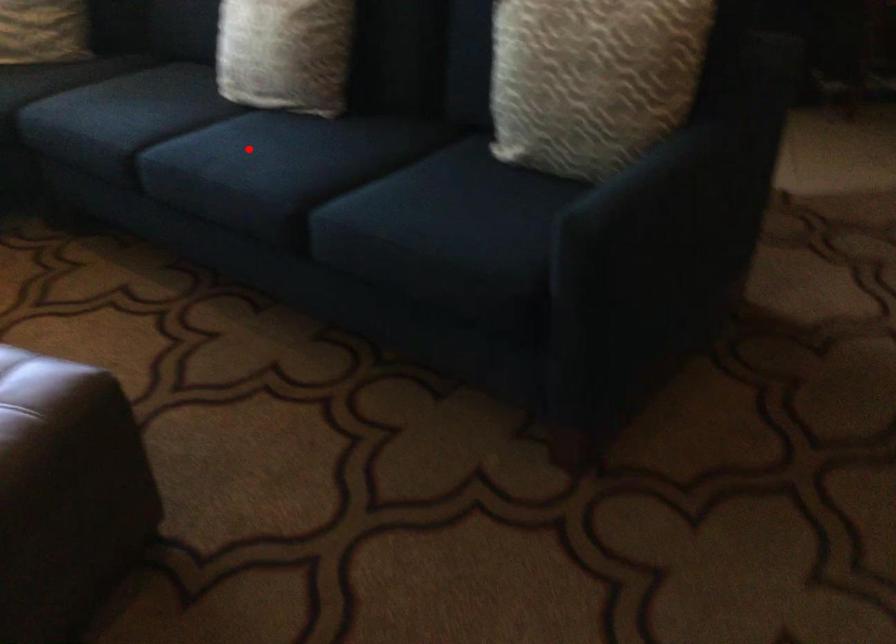
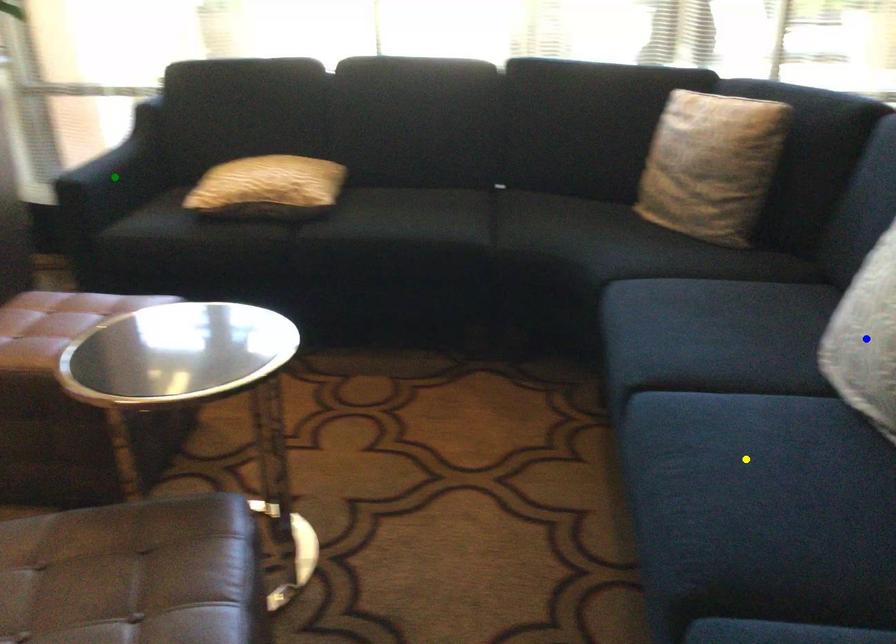
Question: I am providing you with two images of the same scene from different viewpoints. A red point is marked on the first image. You are given multiple points on the second image. Can you choose the point in image 2 that corresponds to the point in image 1?

Choices:
 (A) blue point
 (B) yellow point
 (C) green point

Answer: (B)